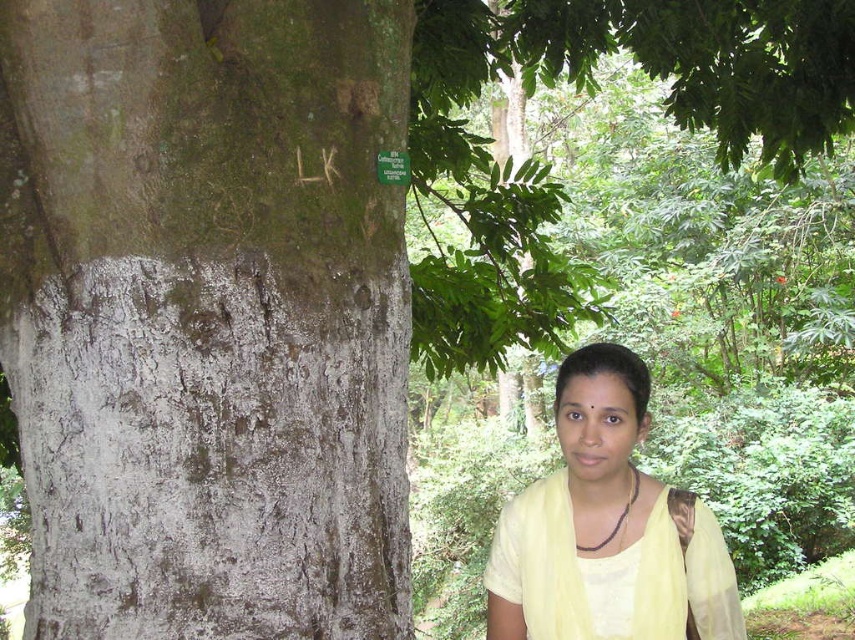
Based on the photo, you are an observer standing in front of the tree. You see the green rough bark at left and the yellow sheer fabric at lower right. Which object is closer to your left side?

The green rough bark at left is closer to your left side because it is positioned on the left side of the yellow sheer fabric at lower right.

You are a photographer trying to capture the green rough bark at left and the yellow sheer fabric at lower right in the same frame. Based on their positions, which object would appear closer to the camera?

The green rough bark at left is in front of the yellow sheer fabric at lower right, so it would appear closer to the camera.

You are an artist trying to sketch this scene. You want to ensure the proportions are accurate. Which object should you draw first, the green rough bark at left or the yellow sheer fabric at lower right, and why?

You should draw the green rough bark at left first because it is larger in size than the yellow sheer fabric at lower right, making it a foundational element in the composition.